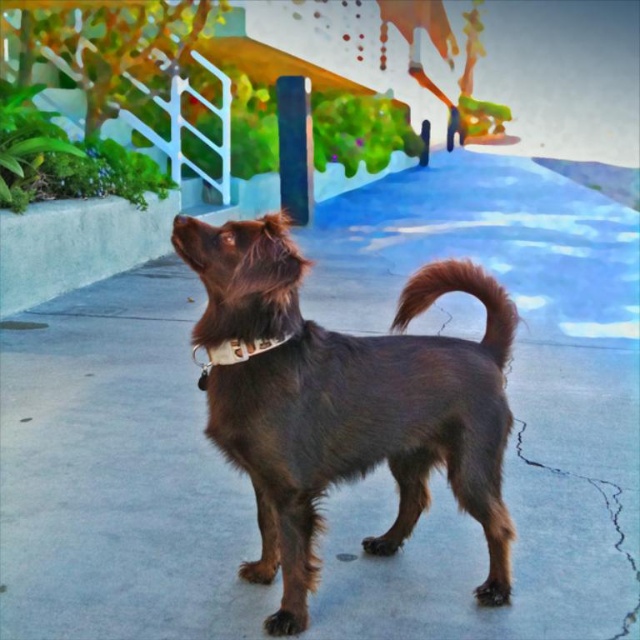
You are a photographer trying to capture a clear picture of the white fabric neckband at center and the brown furry tail at center. Since they are both at the center, which one will appear closer to the camera in the photo?

The brown furry tail at center appears closer to the camera because the white fabric neckband at center is positioned behind it.

You are a photographer trying to capture the brown furry dog at center and the brown fur nose at center in a single shot. Since you want to ensure both are fully visible, which object should you focus on to frame the shot properly?

You should focus on the brown furry dog at center because its width is larger than the brown fur nose at center, making it the dominant subject to frame the shot properly.

Based on the photo, you are a photographer trying to capture the brown furry dog at center and the brown fur nose at center in a single shot. Based on their positions, which one is closer to the camera?

The brown fur nose at center is closer to the camera since it is positioned above the brown furry dog at center.